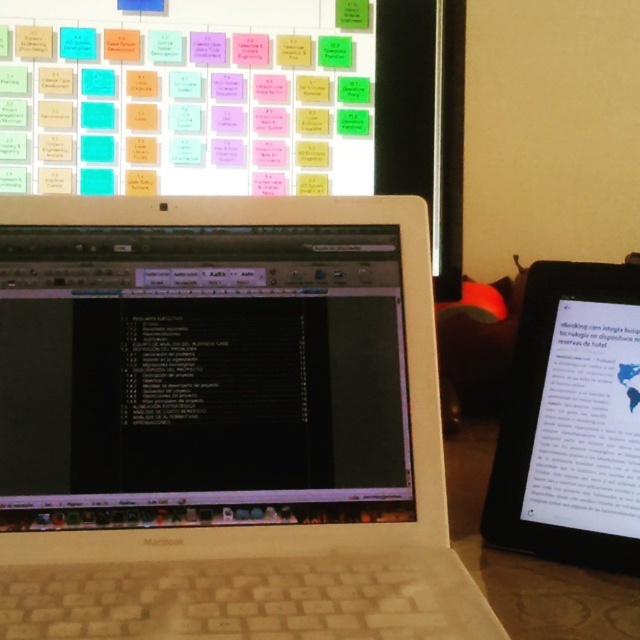
In the scene shown: You are a graphic designer working on a project. You need to place a new sticky note on the large screen in the background. The screen has a coordinate system where the bottom left corner is the origin point. The existing sticky notes are placed at coordinates ranging from 0.2 to 0.8 on both the x and y axes. You want to place your new sticky note at the point marked by point (221, 422). Is this coordinate within the valid range for placing sticky notes?

The point (221, 422) is within the valid range since the existing sticky notes are placed between 0.2 to 0.8 on both axes, so yes, the new sticky note can be placed there.

You have a desk space that can only accommodate items up to the width of the black glossy tablet at right. Can the white plastic laptop at center fit on this desk space?

The white plastic laptop at center is wider than the black glossy tablet at right, so it cannot fit on the desk space designated for items up to the tablet width.

You are a photographer adjusting your camera to focus on two points in the workspace scene. The first point is labeled as point (410, 380) and the second is point (561, 467). Since you can only focus on one point at a time, which point should you choose to ensure the foreground MacBook laptop is in focus while keeping the background monitor somewhat sharp?

You should focus on point (410, 380) because it is closer to the camera than point (561, 467). Focusing on the closer point will keep the foreground MacBook laptop in focus, and the background monitor will remain somewhat sharp due to the depth of field.